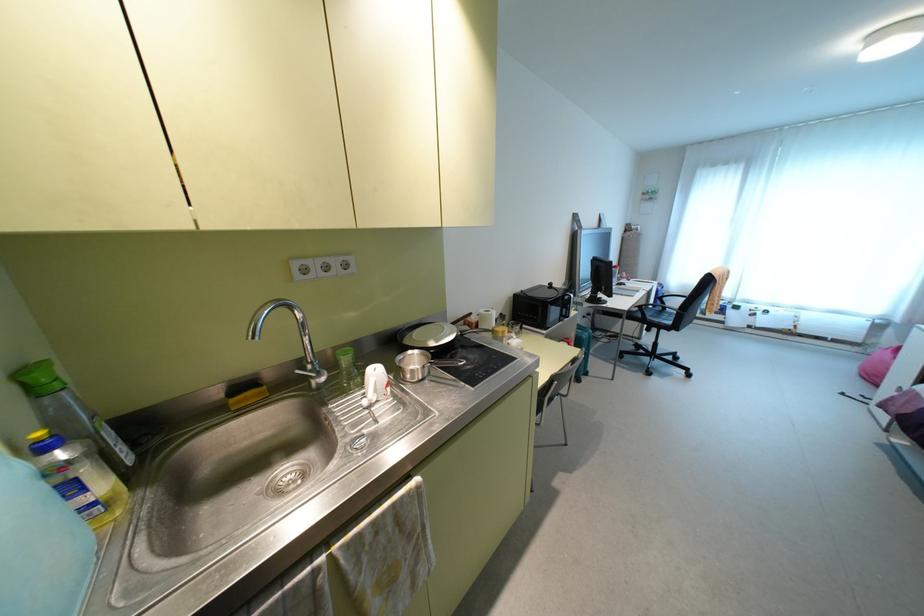
At what (x,y) coordinates should I click in order to perform the action: click on microwave handle. Please return your answer as a coordinate pair (x, y). This screenshot has width=924, height=616. Looking at the image, I should click on (567, 305).